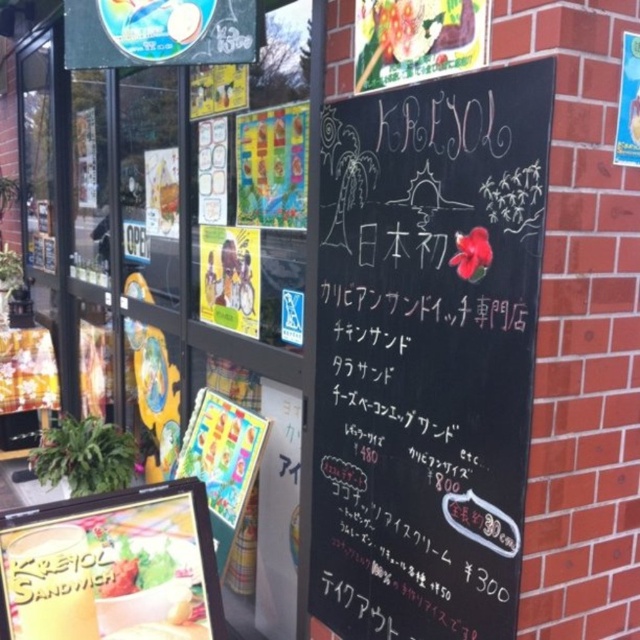
Which is more to the right, black chalkboard at center or green leafy salad at lower left?

black chalkboard at center is more to the right.

Does point (376, 477) lie in front of point (100, 595)?

Yes.

Identify the location of black chalkboard at center. (428, 353).